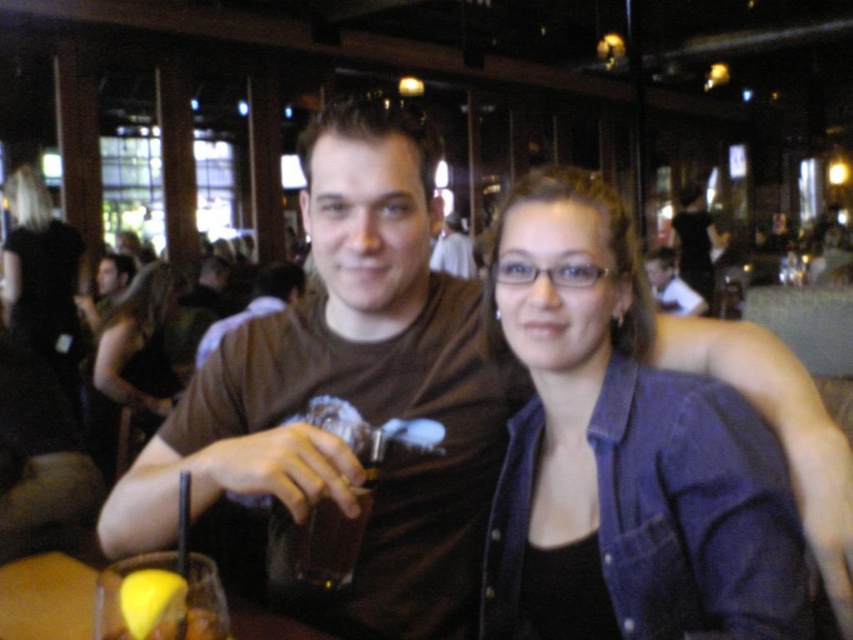
You are a photographer adjusting lighting for a portrait. You notice two subjects wearing the matte black tank top at center and the matte brown shirt at center. Which subject should you position closer to the light source to ensure both appear equally illuminated, considering their clothing colors and sizes?

The matte black tank top at center has a larger size compared to the matte brown shirt at center. Since black absorbs more light and the tank top is larger, positioning the matte black tank top at center closer to the light source will help balance the illumination between both subjects.

You are a bartender preparing a drink and need to place the translucent plastic cup at lower left next to the matte black tank top at center. Considering their heights, which one should you position lower to ensure they are stable on the table?

The translucent plastic cup at lower left is not as tall as the matte black tank top at center, so you should position the translucent plastic cup at lower left lower to ensure stability.